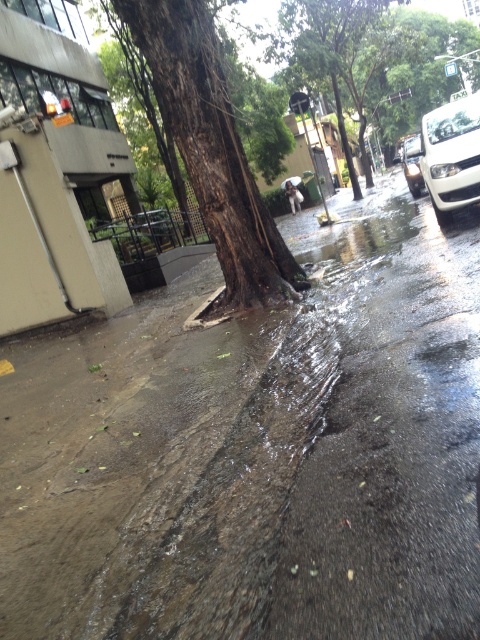
Question: Observing the image, what is the correct spatial positioning of brown rough bark tree at center in reference to white glossy car at right?

Choices:
 (A) left
 (B) right

Answer: (A)

Question: Which object is the closest to the brown rough bark tree at center?

Choices:
 (A) wet asphalt pavement at center
 (B) white glossy car at right
 (C) white glossy car at upper right

Answer: (A)

Question: Which of the following is the closest to the observer?

Choices:
 (A) white glossy car at upper right
 (B) brown rough bark tree at center
 (C) white glossy car at right

Answer: (B)

Question: Which of the following is the farthest from the observer?

Choices:
 (A) white glossy car at right
 (B) white glossy car at upper right

Answer: (B)

Question: Where is wet asphalt pavement at center located in relation to brown rough bark tree at center in the image?

Choices:
 (A) right
 (B) left

Answer: (A)

Question: Does brown rough bark tree at center have a greater width compared to green leafy tree at upper center?

Choices:
 (A) yes
 (B) no

Answer: (B)